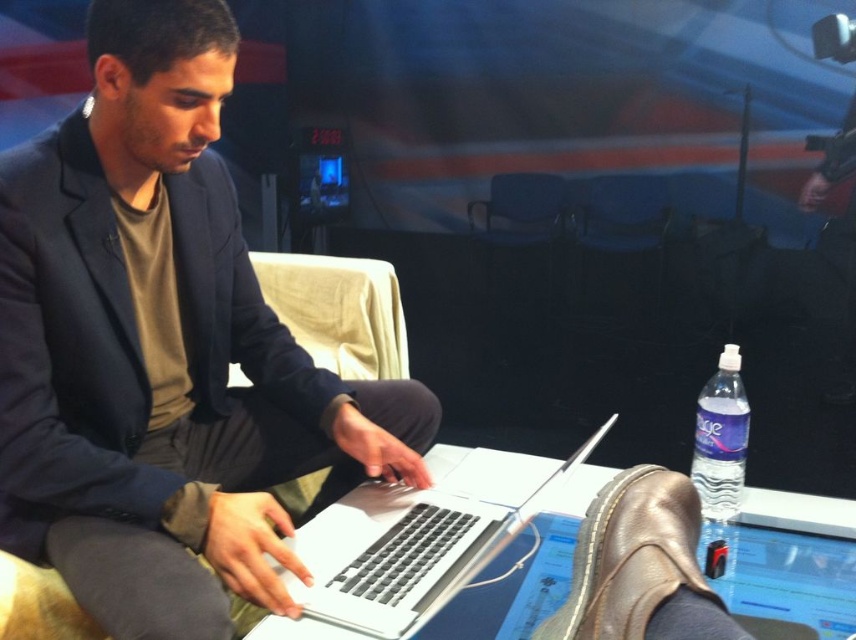
You are an office assistant who needs to place a new document on the desk. The document must be placed between the matte black laptop at center and the clear plastic water bottle at lower right. Is this possible?

The matte black laptop at center is in front of the clear plastic water bottle at lower right, so there is space between them. Therefore, you can place the document between the matte black laptop at center and the clear plastic water bottle at lower right.

You are a photographer setting up a shoot in the room. You need to place a tripod between the matte black laptop at center and the clear plastic water bottle at lower right. Since the laptop is to the left of the water bottle, where should you position the tripod relative to the laptop?

The matte black laptop at center is to the left of the clear plastic water bottle at lower right, so you should position the tripod to the right of the matte black laptop at center, between the two objects.

You are organizing a meeting in this room and need to place a new document holder between the silver metallic laptop at center and the clear plastic water bottle at lower right. Which object should the document holder be placed closer to if it needs to be positioned at the same height as the taller object?

The document holder should be placed closer to the clear plastic water bottle at lower right because it is taller than the silver metallic laptop at center.